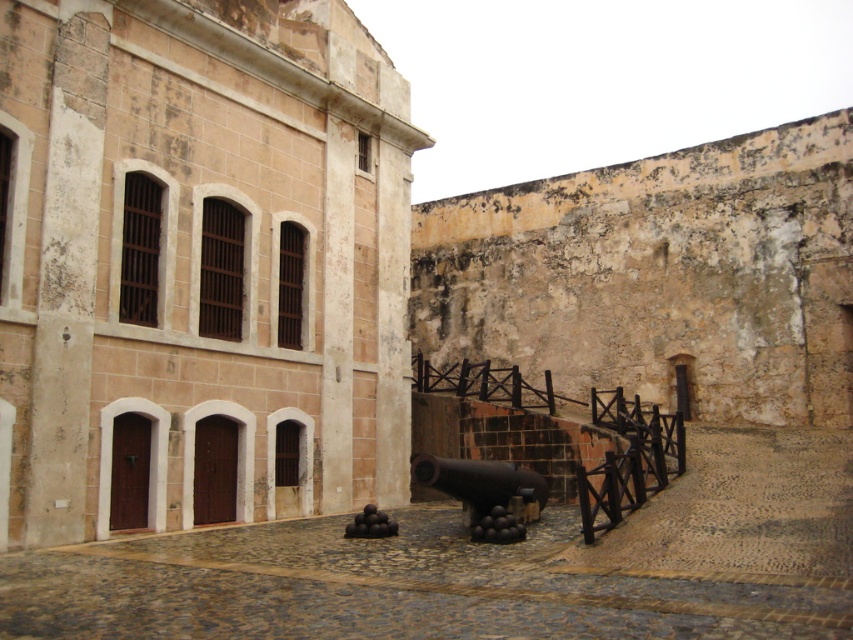
Question: Which point is farther to the camera?

Choices:
 (A) (505, 467)
 (B) (349, 20)

Answer: (B)

Question: Which of the following is the farthest from the observer?

Choices:
 (A) (515, 486)
 (B) (219, 13)

Answer: (B)

Question: Considering the relative positions of matte stone building at center and black matte cannon at center in the image provided, where is matte stone building at center located with respect to black matte cannon at center?

Choices:
 (A) above
 (B) below

Answer: (A)

Question: Which point appears farthest from the camera in this image?

Choices:
 (A) (543, 484)
 (B) (202, 228)

Answer: (B)

Question: Is matte stone building at center below black matte cannon at center?

Choices:
 (A) no
 (B) yes

Answer: (A)

Question: Is the position of matte stone building at center less distant than that of black matte cannon at center?

Choices:
 (A) yes
 (B) no

Answer: (A)